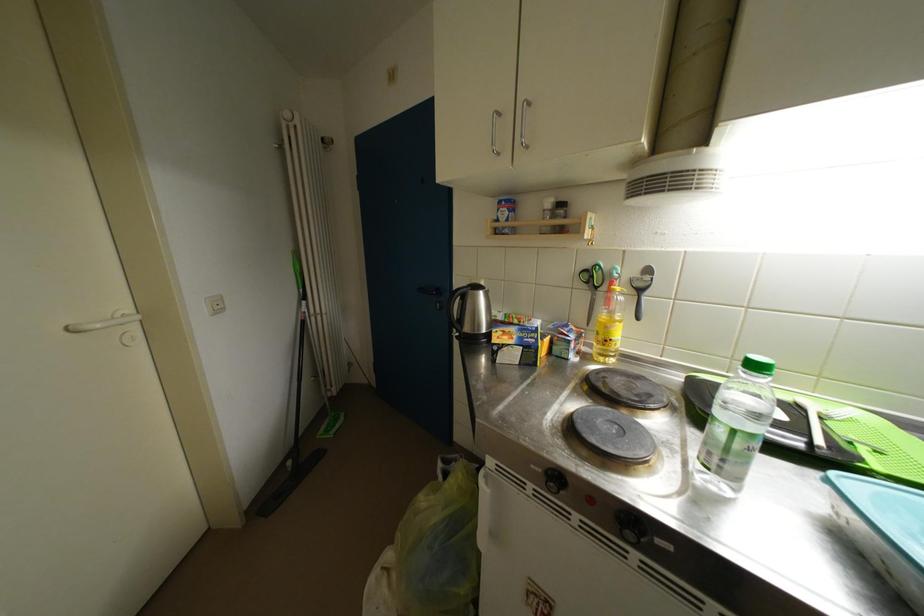
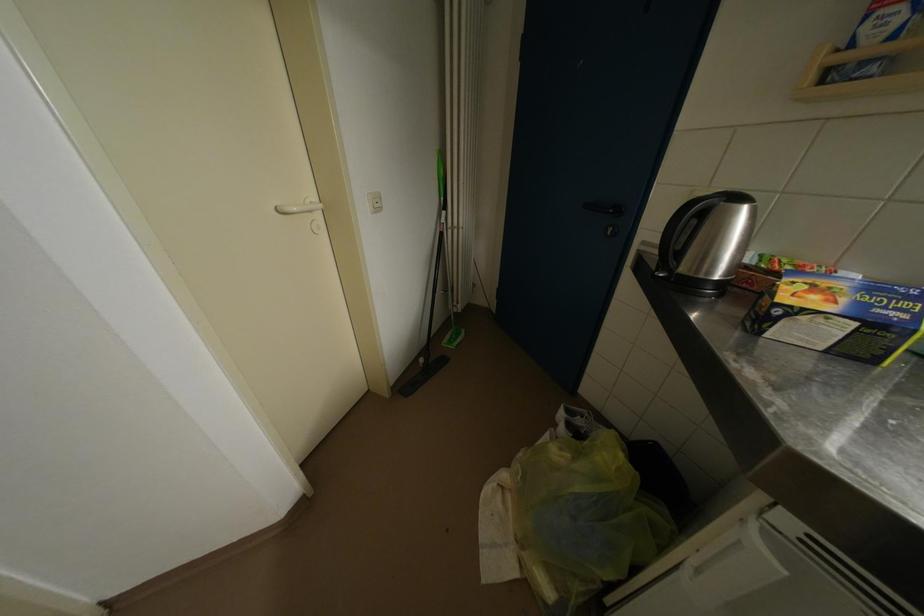
Locate, in the second image, the point that corresponds to the point at 488,297 in the first image.

(752, 213)